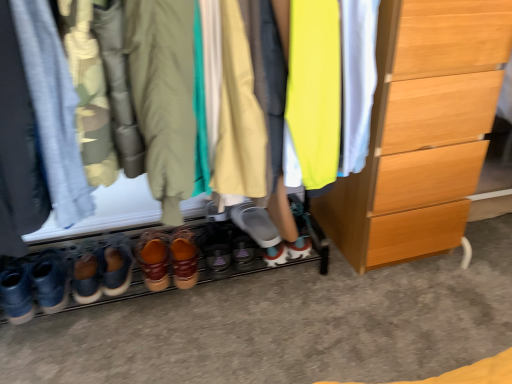
Question: Considering the relative sizes of leather brown shoes at lower left, the sixth footwear in the right-to-left sequence, and matte gray shoe at center, which is the 6th footwear in left-to-right order, in the image provided, is leather brown shoes at lower left, the sixth footwear in the right-to-left sequence, bigger than matte gray shoe at center, which is the 6th footwear in left-to-right order,?

Choices:
 (A) yes
 (B) no

Answer: (A)

Question: From the image's perspective, would you say leather brown shoes at lower left, the 1th footwear viewed from the left, is positioned over matte gray shoe at center, which is counted as the 1th footwear, starting from the right?

Choices:
 (A) no
 (B) yes

Answer: (A)

Question: Is leather brown shoes at lower left, the 1th footwear viewed from the left, positioned with its back to matte gray shoe at center, which is counted as the 1th footwear, starting from the right?

Choices:
 (A) no
 (B) yes

Answer: (A)

Question: Does leather brown shoes at lower left, the 1th footwear viewed from the left, appear on the right side of matte gray shoe at center, which is the 6th footwear in left-to-right order?

Choices:
 (A) yes
 (B) no

Answer: (B)

Question: Is matte gray shoe at center, which is counted as the 1th footwear, starting from the right, a part of leather brown shoes at lower left, the sixth footwear in the right-to-left sequence?

Choices:
 (A) no
 (B) yes

Answer: (A)

Question: Looking at their shapes, would you say leather-like brown shoes at center, arranged as the second footwear when viewed from the right, is wider or thinner than leather boots at center, which is counted as the fourth footwear, starting from the left?

Choices:
 (A) wide
 (B) thin

Answer: (B)

Question: Is leather-like brown shoes at center, placed as the 5th footwear when sorted from left to right, to the left or to the right of leather boots at center, which is counted as the fourth footwear, starting from the left, in the image?

Choices:
 (A) right
 (B) left

Answer: (A)

Question: From a real-world perspective, relative to leather boots at center, the 3th footwear when ordered from right to left, is leather-like brown shoes at center, arranged as the second footwear when viewed from the right, vertically above or below?

Choices:
 (A) above
 (B) below

Answer: (A)

Question: Is point (177, 283) positioned closer to the camera than point (242, 230)?

Choices:
 (A) farther
 (B) closer

Answer: (B)

Question: Does point (103, 254) appear closer or farther from the camera than point (178, 228)?

Choices:
 (A) farther
 (B) closer

Answer: (B)

Question: Considering the positions of brown suede shoes at lower center, which ranks as the 2th footwear in left-to-right order, and leather-like brown shoes at center, arranged as the second footwear when viewed from the right, in the image, is brown suede shoes at lower center, which ranks as the 2th footwear in left-to-right order, taller or shorter than leather-like brown shoes at center, arranged as the second footwear when viewed from the right,?

Choices:
 (A) tall
 (B) short

Answer: (A)

Question: From the image's perspective, is brown suede shoes at lower center, which ranks as the 2th footwear in left-to-right order, above or below leather-like brown shoes at center, arranged as the second footwear when viewed from the right?

Choices:
 (A) below
 (B) above

Answer: (A)

Question: Is brown suede shoes at lower center, which ranks as the 2th footwear in left-to-right order, to the left or to the right of leather-like brown shoes at center, arranged as the second footwear when viewed from the right, in the image?

Choices:
 (A) left
 (B) right

Answer: (A)

Question: Is matte gray shoe at center, which is counted as the 1th footwear, starting from the right, inside the boundaries of leather brown shoes at lower left, the 1th footwear viewed from the left, or outside?

Choices:
 (A) outside
 (B) inside

Answer: (A)

Question: Considering the positions of matte gray shoe at center, which is counted as the 1th footwear, starting from the right, and leather brown shoes at lower left, the 1th footwear viewed from the left, in the image, is matte gray shoe at center, which is counted as the 1th footwear, starting from the right, bigger or smaller than leather brown shoes at lower left, the 1th footwear viewed from the left,?

Choices:
 (A) big
 (B) small

Answer: (B)